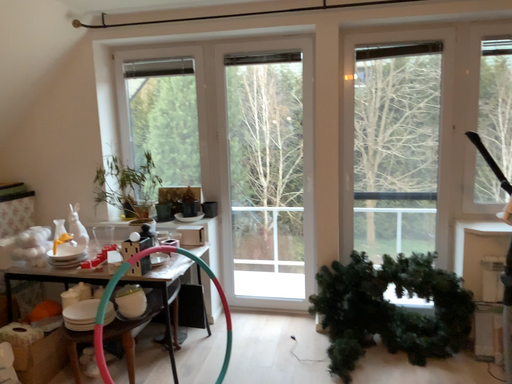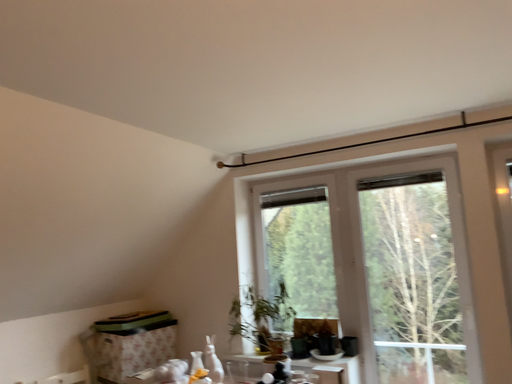
Question: Which way did the camera rotate in the video?

Choices:
 (A) rotated left
 (B) rotated right

Answer: (A)